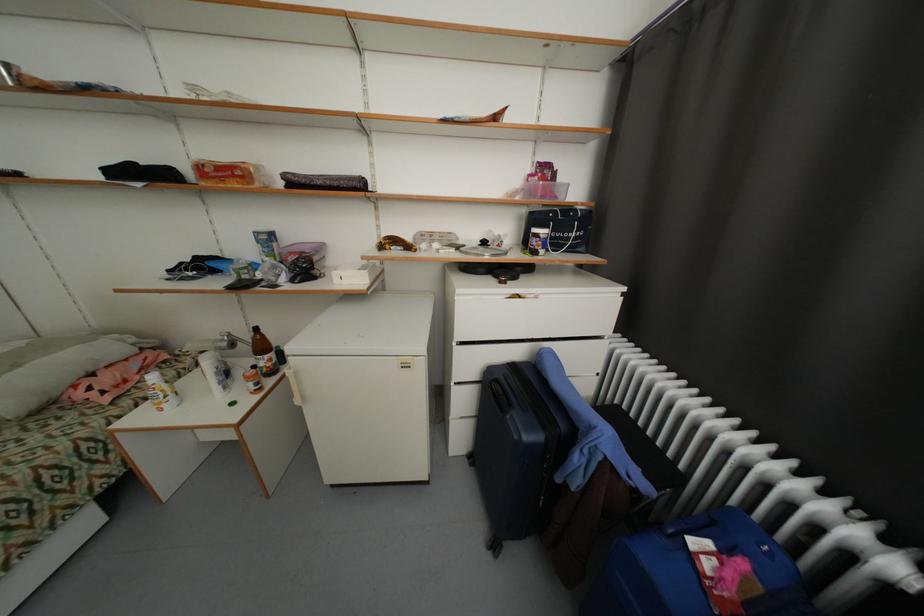
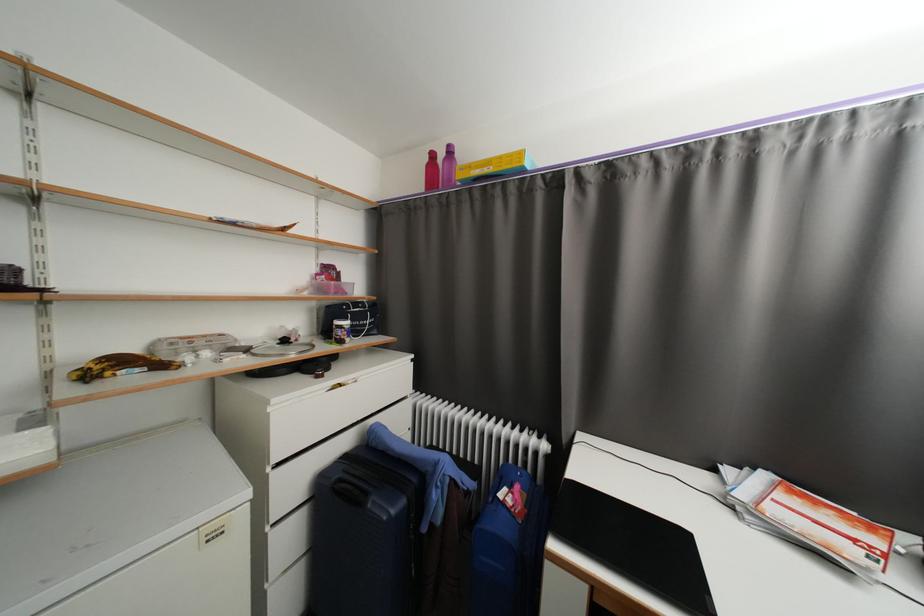
Locate, in the second image, the point that corresponds to the point at 415,249 in the first image.

(167, 367)